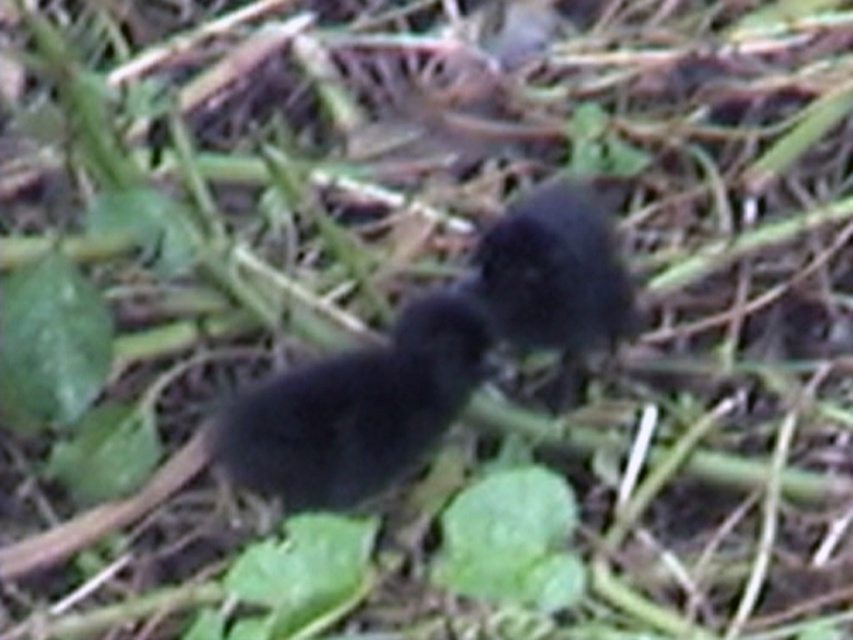
You are a wildlife photographer trying to capture a closeup of the black matte bird at center and the black fuzzy bird at center. Which bird should you focus on if you want to photograph the taller one?

The black fuzzy bird at center is taller than the black matte bird at center, so you should focus on the black fuzzy bird at center to photograph the taller one.

You are a birdwatcher trying to observe two birds in the image. You notice two points marked in the image. Which point is closer to you, point (367, 372) or point (602, 212)?

Point (367, 372) is closer to the viewer than point (602, 212).

You are a wildlife photographer aiming to capture a clear photo of the black matte bird at center. Based on the scene description, what challenge might you face due to the bird being at that specific location?

The black matte bird at center is located at point [357,410], which might be surrounded by scattered brownish twigs or dried plant material in the background. This could cause the bird to blend in with the muted colors and blurry details, making it difficult to capture a clear photo.